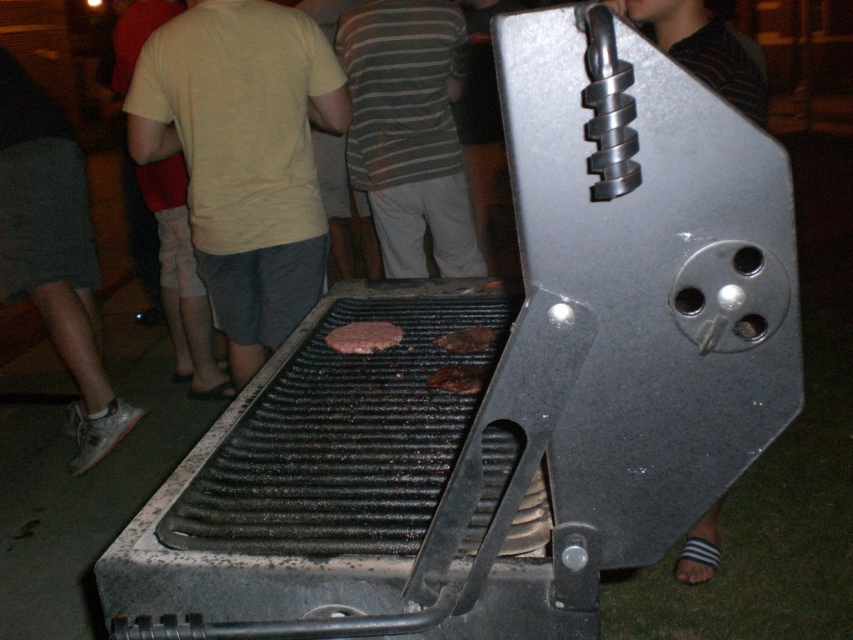
You are standing in front of the grill and want to place a new burger patty on the grill. Based on the current arrangement of the black matte grill at center and the brown matte burger patty at center, where should you place the new burger patty?

The black matte grill at center is to the right of the brown matte burger patty at center, so you should place the new burger patty to the left of the brown matte burger patty at center to utilize the available space on the grill.

You are a food delivery robot with a 1.5 meter long tray. You need to pick up the brown matte burger patty at center from the grill and deliver it to the person wearing the striped fabric shirt at center. Can your tray reach from the burger to the shirt without moving the tray?

The distance between the striped fabric shirt at center and the brown matte burger patty at center is 1.85 meters. Since your tray is only 1.5 meters long, it cannot reach the required distance. You will need to move closer or use a longer tray.